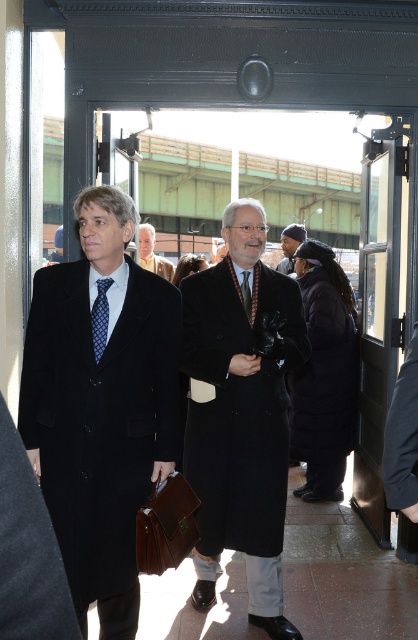
Based on the scene description, where is the matte black coat at left located in terms of coordinates?

The matte black coat at left is located at point (101, 406).

Based on the coordinates provided, which object is located at point (241, 413)?

The point (241, 413) corresponds to the matte black coat at center.